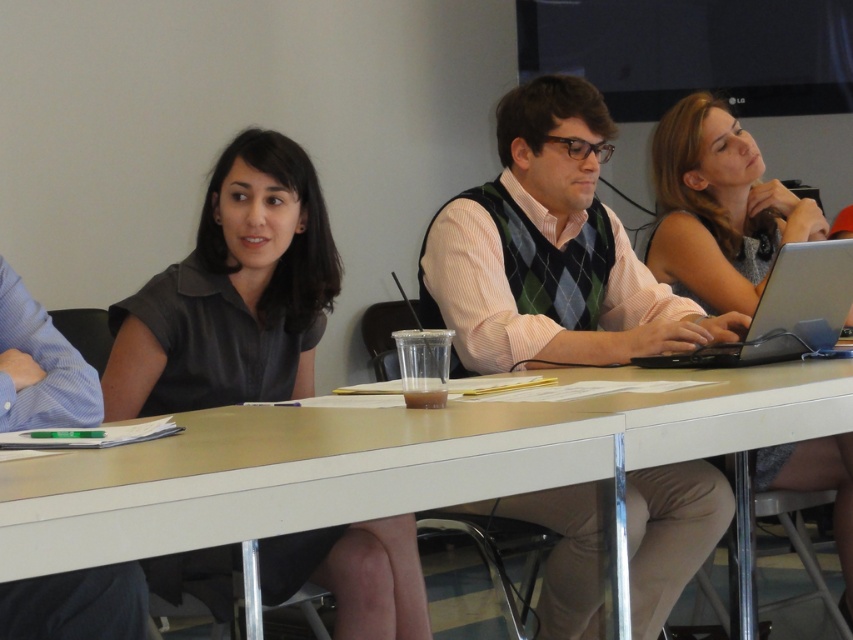
Where is the smooth white table at center located in the image?

The smooth white table at center is located at point (386, 460) in the image.

You are standing in front of the table and want to reach both points on the table. Which point, point (440, 448) or point (288, 323), is closer to you?

Point (440, 448) is closer to you because it is closer to the camera than point (288, 323).